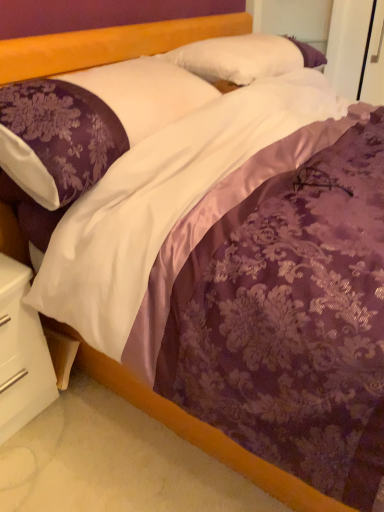
Question: From a real-world perspective, is white satin pillow at upper center, marked as the first pillow in a back-to-front arrangement, positioned above or below white glossy nightstand at lower left?

Choices:
 (A) below
 (B) above

Answer: (B)

Question: From the image's perspective, is white satin pillow at upper center, marked as the second pillow in a front-to-back arrangement, positioned above or below white glossy nightstand at lower left?

Choices:
 (A) below
 (B) above

Answer: (B)

Question: Which object is positioned closest to the white satin pillow at upper center, marked as the first pillow in a back-to-front arrangement?

Choices:
 (A) white glossy nightstand at lower left
 (B) purple satin pillow at upper left, which is the 2th pillow from back to front

Answer: (B)

Question: Which object is positioned closest to the white satin pillow at upper center, marked as the second pillow in a front-to-back arrangement?

Choices:
 (A) white glossy nightstand at lower left
 (B) purple satin pillow at upper left, positioned as the 1th pillow in front-to-back order

Answer: (B)